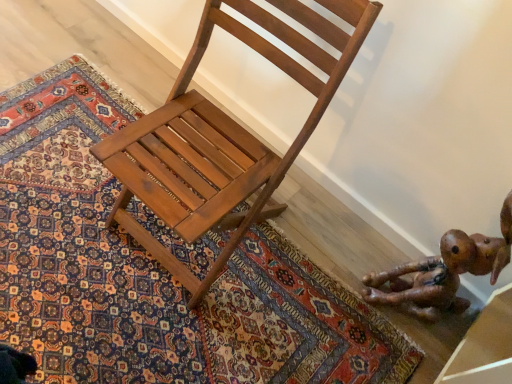
Where is `free region on the left part of shiny brown wood chair at center`? The width and height of the screenshot is (512, 384). free region on the left part of shiny brown wood chair at center is located at coordinates (63, 219).